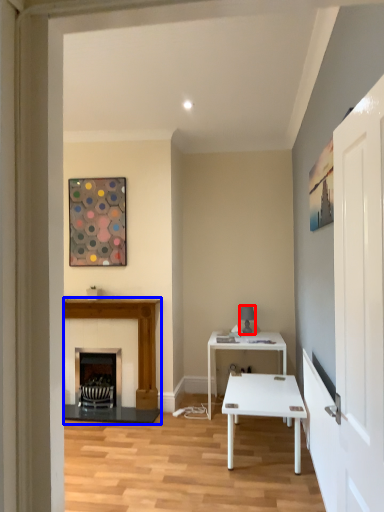
Question: Which of the following is the farthest to the observer, lamp (highlighted by a red box) or fireplace (highlighted by a blue box)?

Choices:
 (A) lamp
 (B) fireplace

Answer: (A)